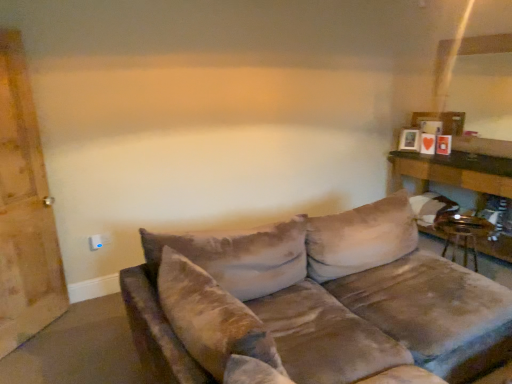
Question: From a real-world perspective, does white plastic electric outlet at lower left sit lower than wooden barn door at left?

Choices:
 (A) no
 (B) yes

Answer: (B)

Question: Is white plastic electric outlet at lower left thinner than wooden barn door at left?

Choices:
 (A) yes
 (B) no

Answer: (A)

Question: Is wooden barn door at left at the back of white plastic electric outlet at lower left?

Choices:
 (A) no
 (B) yes

Answer: (A)

Question: From a real-world perspective, is white plastic electric outlet at lower left located higher than wooden barn door at left?

Choices:
 (A) no
 (B) yes

Answer: (A)

Question: Is white plastic electric outlet at lower left taller than wooden barn door at left?

Choices:
 (A) no
 (B) yes

Answer: (A)

Question: Is white plastic electric outlet at lower left facing towards wooden barn door at left?

Choices:
 (A) yes
 (B) no

Answer: (B)

Question: Does velvet brown couch at center have a greater height compared to wooden barn door at left?

Choices:
 (A) yes
 (B) no

Answer: (B)

Question: Can you confirm if velvet brown couch at center is smaller than wooden barn door at left?

Choices:
 (A) no
 (B) yes

Answer: (A)

Question: Is velvet brown couch at center completely or partially outside of wooden barn door at left?

Choices:
 (A) yes
 (B) no

Answer: (A)

Question: Does velvet brown couch at center have a larger size compared to wooden barn door at left?

Choices:
 (A) yes
 (B) no

Answer: (A)

Question: Is velvet brown couch at center thinner than wooden barn door at left?

Choices:
 (A) yes
 (B) no

Answer: (B)

Question: From the image's perspective, is velvet brown couch at center beneath wooden barn door at left?

Choices:
 (A) yes
 (B) no

Answer: (A)

Question: From the image's perspective, is white plastic electric outlet at lower left over wooden table at right?

Choices:
 (A) yes
 (B) no

Answer: (B)